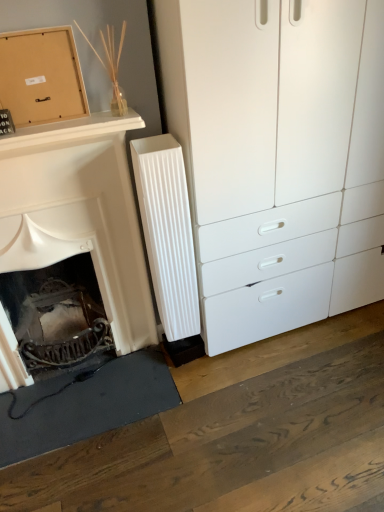
Find the location of a particular element. The width and height of the screenshot is (384, 512). free space in front of white matte fireplace at left is located at coordinates (105, 465).